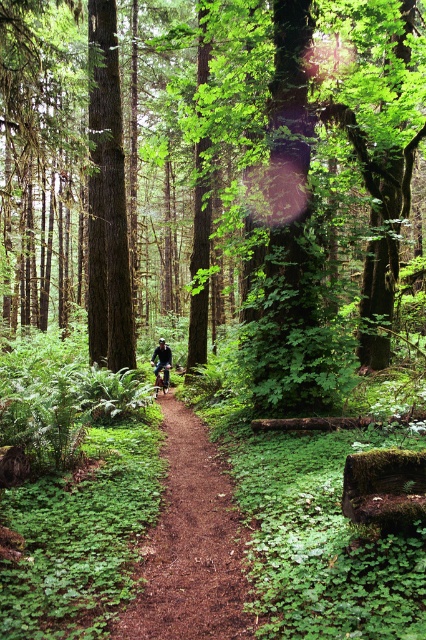
Question: Can you confirm if green leafy tree at center is smaller than brown dirt path at center?

Choices:
 (A) yes
 (B) no

Answer: (B)

Question: Which point is closer to the camera?

Choices:
 (A) (166, 362)
 (B) (181, 412)
 (C) (161, 364)

Answer: (B)

Question: Can you confirm if dark brown wood tree at center is positioned to the left of shiny metallic mountain bike at center?

Choices:
 (A) yes
 (B) no

Answer: (A)

Question: Which point appears farthest from the camera in this image?

Choices:
 (A) (276, 3)
 (B) (158, 381)

Answer: (B)

Question: Is brown dirt path at center smaller than shiny metallic mountain bike at center?

Choices:
 (A) no
 (B) yes

Answer: (A)

Question: Which object is closer to the camera taking this photo?

Choices:
 (A) shiny metallic mountain bike at center
 (B) green leafy tree at center
 (C) black matte bicycle at center
 (D) dark brown wood tree at center

Answer: (B)